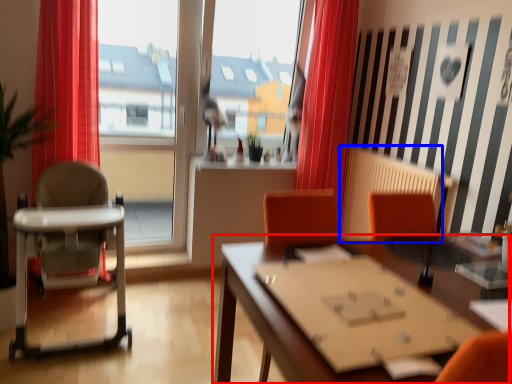
Question: Which point is further to the camera, table (highlighted by a red box) or radiator (highlighted by a blue box)?

Choices:
 (A) table
 (B) radiator

Answer: (B)